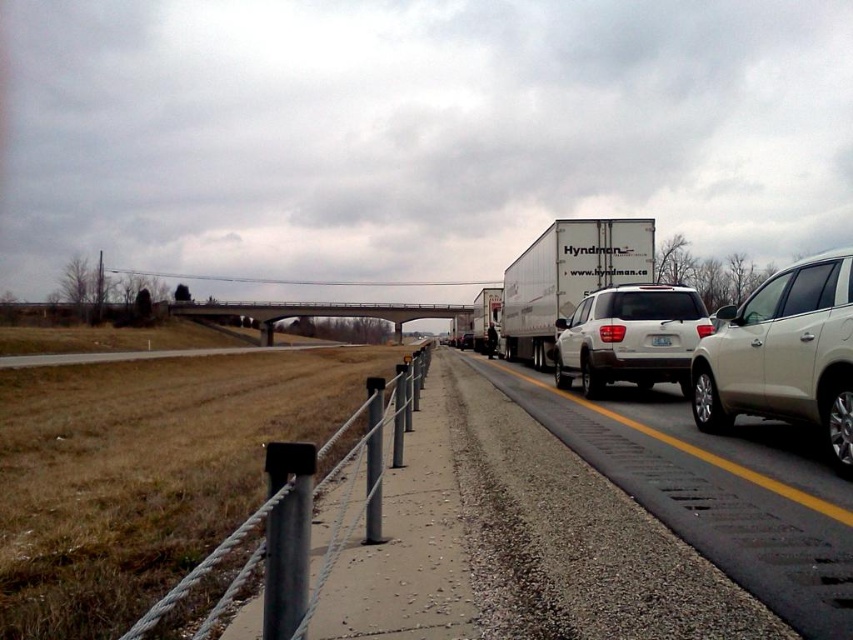
Question: Which of the following is the farthest from the observer?

Choices:
 (A) white plastic license plate at center
 (B) white glossy trailer truck at center-right
 (C) white matte suv at right
 (D) white matte suv at center

Answer: (B)

Question: Does white matte suv at right have a lesser width compared to white matte suv at center?

Choices:
 (A) no
 (B) yes

Answer: (B)

Question: Does black asphalt road at center appear under white matte suv at center?

Choices:
 (A) no
 (B) yes

Answer: (B)

Question: Does white matte suv at center have a lesser width compared to white glossy trailer truck at center-right?

Choices:
 (A) yes
 (B) no

Answer: (A)

Question: Which point is closer to the camera taking this photo?

Choices:
 (A) (659, 337)
 (B) (531, 250)
 (C) (778, 378)
 (D) (610, 307)

Answer: (C)

Question: Which point is closer to the camera taking this photo?

Choices:
 (A) (744, 304)
 (B) (561, 400)
 (C) (665, 339)

Answer: (A)